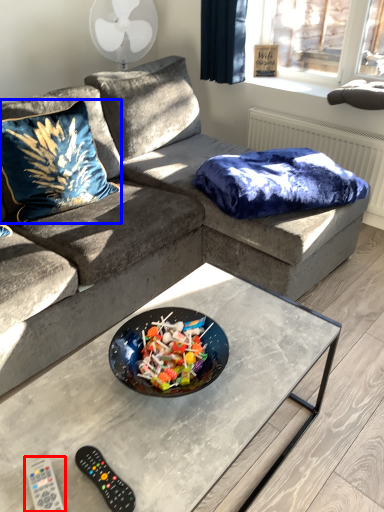
Question: Which object is closer to the camera taking this photo, remote (highlighted by a red box) or throw pillow (highlighted by a blue box)?

Choices:
 (A) remote
 (B) throw pillow

Answer: (A)